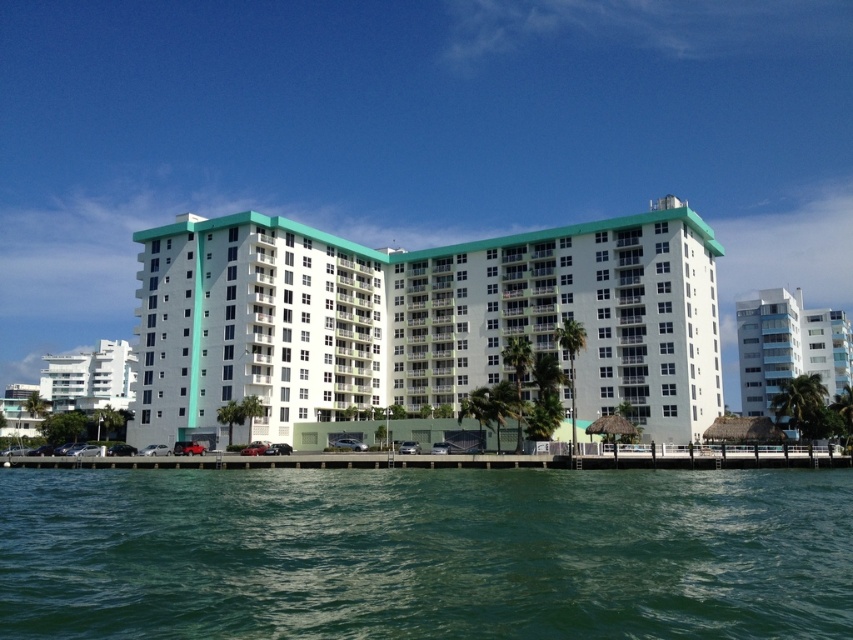
Which is behind, point (689, 243) or point (50, 397)?

The point (50, 397) is behind.

Can you confirm if white glossy building at center is shorter than white glossy building at left?

No.

What do you see at coordinates (421, 321) in the screenshot? This screenshot has height=640, width=853. I see `white glossy building at center` at bounding box center [421, 321].

Find the location of a particular element. This screenshot has width=853, height=640. white glossy building at center is located at coordinates (421, 321).

Between white glossy building at center and white glass building at right, which one appears on the left side from the viewer's perspective?

Positioned to the left is white glossy building at center.

Does white glossy building at center have a greater height compared to white glass building at right?

Yes, white glossy building at center is taller than white glass building at right.

Does point (653, 400) come farther from viewer compared to point (769, 387)?

No, (653, 400) is closer to viewer.

This screenshot has height=640, width=853. What are the coordinates of `white glossy building at center` in the screenshot? It's located at (421, 321).

Is the position of green water at lower center more distant than that of smooth concrete dock at lower center?

No, green water at lower center is in front of smooth concrete dock at lower center.

Can you confirm if green water at lower center is bigger than smooth concrete dock at lower center?

Yes.

Based on the photo, who is more forward, [374,564] or [173,465]?

Point [374,564] is in front.

The image size is (853, 640). I want to click on green water at lower center, so click(x=425, y=554).